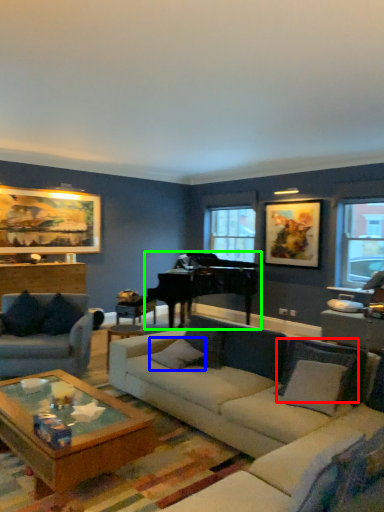
Question: Which object is positioned farthest from pillow (highlighted by a red box)? Select from pillow (highlighted by a blue box) and piano (highlighted by a green box).

Choices:
 (A) pillow
 (B) piano

Answer: (B)